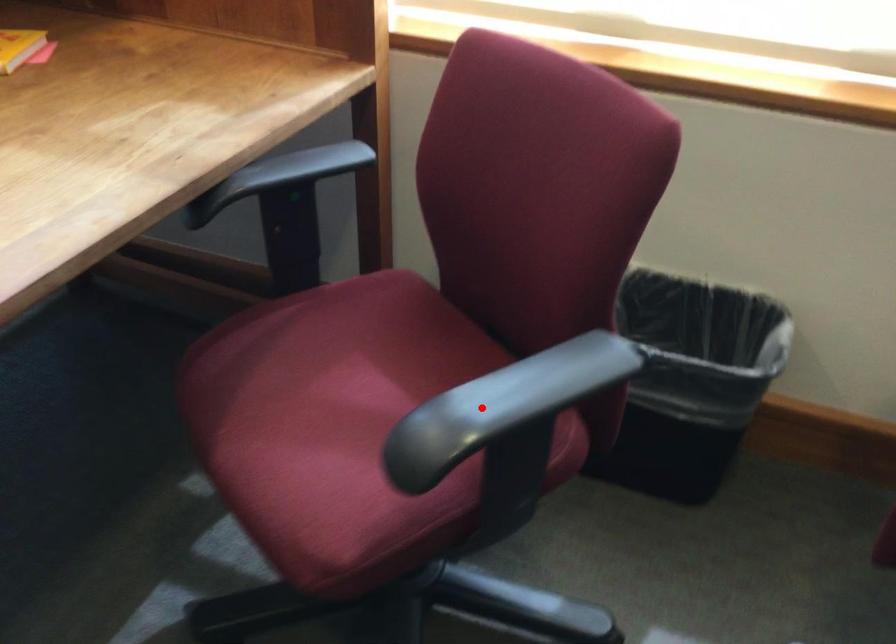
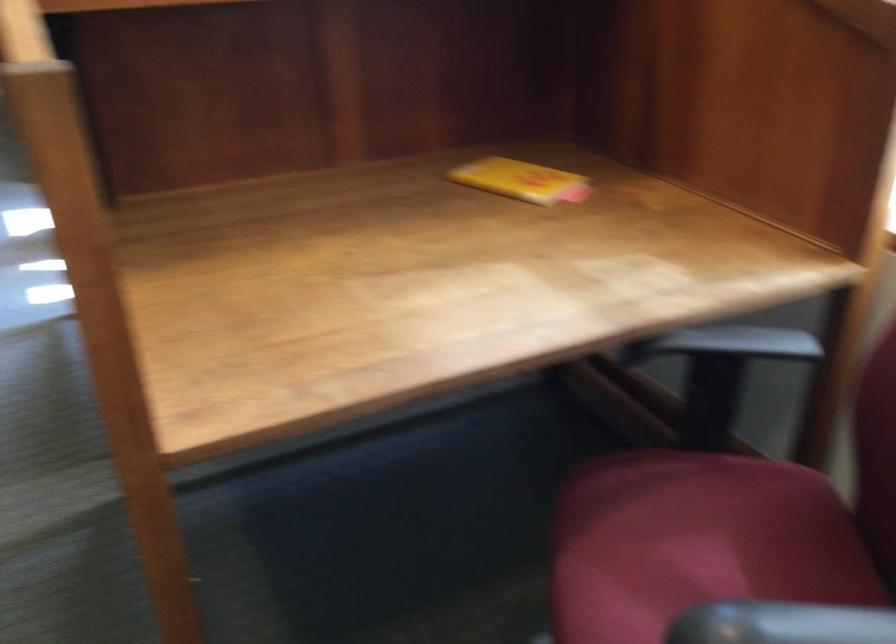
In the second image, find the point that corresponds to the highlighted location in the first image.

(780, 623)